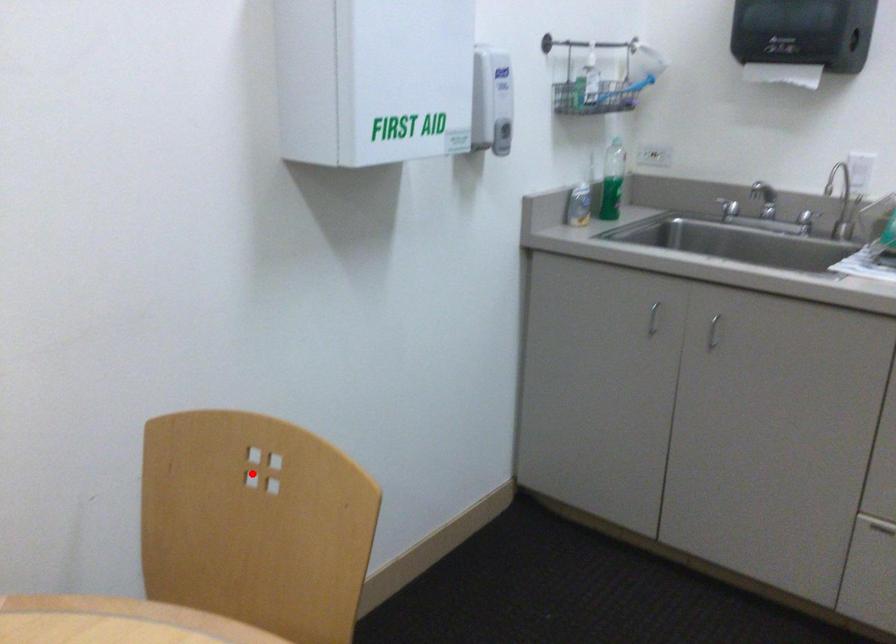
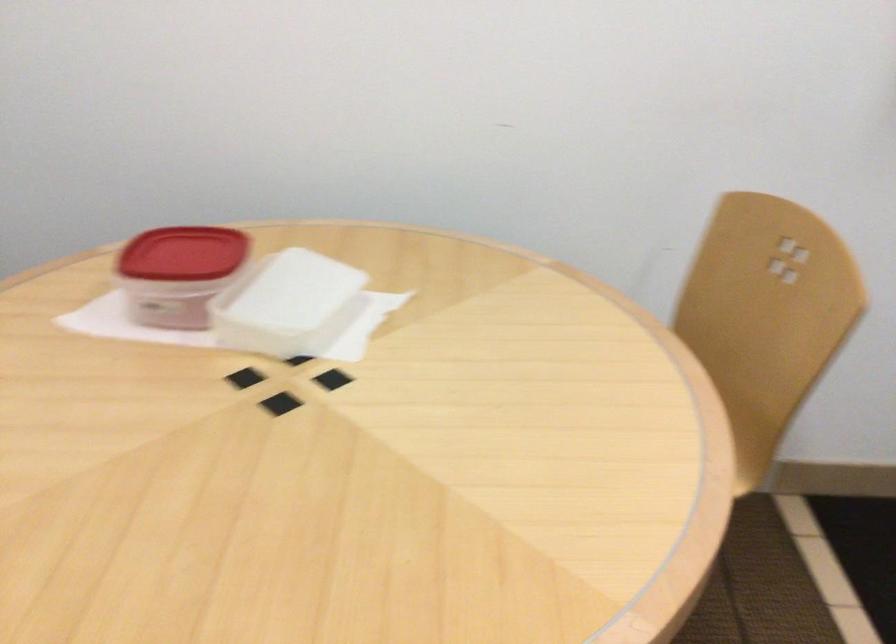
Where in the second image is the point corresponding to the highlighted location from the first image?

(788, 260)